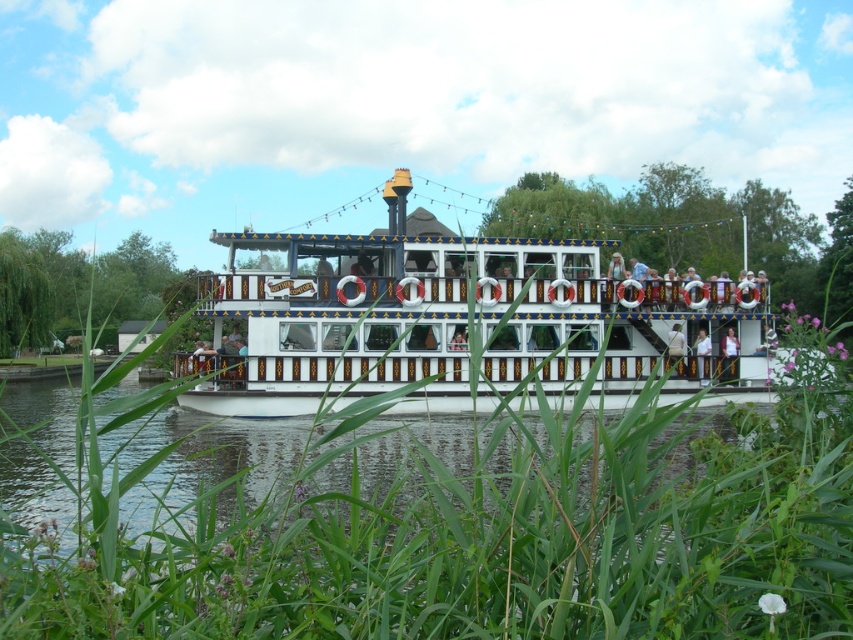
You are standing on the river cruise boat and want to move from the point at coordinates point (143,554) to the point at coordinates point (548,314). Which direction should you move to reach your destination?

You should move backward to reach the point at coordinates point (548,314) because point (143,554) is in front of it.

You are standing on the upper deck of the white cruise boat and looking towards the front. There are two points marked on the boat, point (773, 576) and point (398, 444). Which point is closer to you when you face the front of the boat?

Point (773, 576) is in front of point (398, 444), so when facing the front of the boat, point (773, 576) is closer to you.